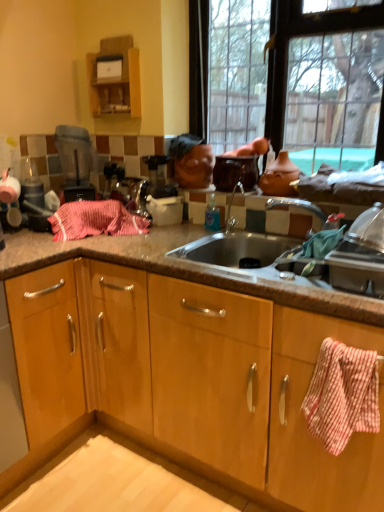
You are a GUI agent. You are given a task and a screenshot of the screen. Output one action in this format:
    pyautogui.click(x=<x>, y=<y>)
    Task: Click on the pink woven towel at center
    The width and height of the screenshot is (384, 512).
    Given the screenshot: What is the action you would take?
    pyautogui.click(x=95, y=220)

Measure the distance between glossy ceramic pot at upper center, the 1th appliance when ordered from right to left, and camera.

The distance of glossy ceramic pot at upper center, the 1th appliance when ordered from right to left, from camera is 6.25 feet.

Find the location of a particular element. red checkered towel at right, the 2th cabinetry viewed from the left is located at coordinates (306, 422).

I want to click on matte black blender at upper left, the 1th appliance positioned from the left, so click(x=75, y=162).

The height and width of the screenshot is (512, 384). I want to click on pink woven towel at center, so click(x=95, y=220).

Considering the positions of objects matte black blender at upper left, which appears as the 2th appliance when viewed from the right, and wooden cabinet at upper left, the second cabinetry positioned from the bottom, in the image provided, who is more to the left, matte black blender at upper left, which appears as the 2th appliance when viewed from the right, or wooden cabinet at upper left, the second cabinetry positioned from the bottom,?

matte black blender at upper left, which appears as the 2th appliance when viewed from the right, is more to the left.

Considering the sizes of objects matte black blender at upper left, the 1th appliance positioned from the left, and wooden cabinet at upper left, which ranks as the first cabinetry in top-to-bottom order, in the image provided, who is wider, matte black blender at upper left, the 1th appliance positioned from the left, or wooden cabinet at upper left, which ranks as the first cabinetry in top-to-bottom order,?

Wider between the two is matte black blender at upper left, the 1th appliance positioned from the left.

Where is `appliance on the left side of wooden cabinet at upper left, acting as the 1th cabinetry starting from the left`? This screenshot has width=384, height=512. appliance on the left side of wooden cabinet at upper left, acting as the 1th cabinetry starting from the left is located at coordinates (75, 162).

What's the angular difference between matte black blender at upper left, which appears as the 2th appliance when viewed from the right, and wooden cabinet at upper left, acting as the first cabinetry starting from the back,'s facing directions?

They differ by 52.9 degrees in their facing directions.

Which object is further away from the camera taking this photo, glossy ceramic pot at upper center, the 1th appliance when ordered from right to left, or matte black blender at upper left, the 1th appliance positioned from the left?

Positioned behind is matte black blender at upper left, the 1th appliance positioned from the left.

Considering the points (234, 174) and (74, 194), which point is behind, point (234, 174) or point (74, 194)?

Positioned behind is point (74, 194).

Which is more to the left, glossy ceramic pot at upper center, which is counted as the 2th appliance, starting from the left, or matte black blender at upper left, the 1th appliance positioned from the left?

matte black blender at upper left, the 1th appliance positioned from the left, is more to the left.

Which of these two, glossy ceramic pot at upper center, which is counted as the 2th appliance, starting from the left, or matte black blender at upper left, which appears as the 2th appliance when viewed from the right, is wider?

With larger width is matte black blender at upper left, which appears as the 2th appliance when viewed from the right.

I want to click on blanket that appears below the glossy ceramic pot at upper center, the 1th appliance when ordered from right to left (from the image's perspective), so click(95, 220).

Is pink woven towel at center further to the viewer compared to glossy ceramic pot at upper center, the 1th appliance when ordered from right to left?

No, pink woven towel at center is closer to the camera.

Does pink woven towel at center turn towards glossy ceramic pot at upper center, which is counted as the 2th appliance, starting from the left?

No, pink woven towel at center does not turn towards glossy ceramic pot at upper center, which is counted as the 2th appliance, starting from the left.

Is pink woven towel at center not inside glossy ceramic pot at upper center, which is counted as the 2th appliance, starting from the left?

Yes.

Is matte glass window at upper center with glossy ceramic pot at upper center, the 1th appliance when ordered from right to left?

No, matte glass window at upper center is not in contact with glossy ceramic pot at upper center, the 1th appliance when ordered from right to left.

What's the angular difference between matte glass window at upper center and glossy ceramic pot at upper center, which is counted as the 2th appliance, starting from the left,'s facing directions?

The angular difference between matte glass window at upper center and glossy ceramic pot at upper center, which is counted as the 2th appliance, starting from the left, is 1.32 degrees.

Considering the points (296, 16) and (225, 162), which point is behind, point (296, 16) or point (225, 162)?

The point (225, 162) is behind.

Does matte glass window at upper center have a lesser width compared to glossy ceramic pot at upper center, which is counted as the 2th appliance, starting from the left?

Indeed, matte glass window at upper center has a lesser width compared to glossy ceramic pot at upper center, which is counted as the 2th appliance, starting from the left.

Locate an element on the screen. The width and height of the screenshot is (384, 512). appliance that is the 1st one when counting upward from the pink woven towel at center (from the image's perspective) is located at coordinates (75, 162).

Can you confirm if matte black blender at upper left, the 1th appliance positioned from the left, is smaller than pink woven towel at center?

Yes, matte black blender at upper left, the 1th appliance positioned from the left, is smaller than pink woven towel at center.

Looking at this image, from a real-world perspective, relative to pink woven towel at center, is matte black blender at upper left, which appears as the 2th appliance when viewed from the right, vertically above or below?

From a real-world perspective, matte black blender at upper left, which appears as the 2th appliance when viewed from the right, is physically above pink woven towel at center.

Could you tell me if matte black blender at upper left, the 1th appliance positioned from the left, is turned towards pink woven towel at center?

Yes, matte black blender at upper left, the 1th appliance positioned from the left, is facing pink woven towel at center.

Who is shorter, matte glass window at upper center or pink woven towel at center?

With less height is pink woven towel at center.

From the picture: Based on their positions, is matte glass window at upper center located to the left or right of pink woven towel at center?

matte glass window at upper center is positioned on pink woven towel at center's right side.

Looking at the image, does matte glass window at upper center seem bigger or smaller compared to pink woven towel at center?

matte glass window at upper center is bigger than pink woven towel at center.

Is pink woven towel at center to the left or to the right of matte glass window at upper center in the image?

pink woven towel at center is positioned on matte glass window at upper center's left side.

Is pink woven towel at center smaller than matte glass window at upper center?

Indeed, pink woven towel at center has a smaller size compared to matte glass window at upper center.

Is pink woven towel at center located outside matte glass window at upper center?

Absolutely, pink woven towel at center is external to matte glass window at upper center.

Is pink woven towel at center oriented away from matte glass window at upper center?

That's not correct — pink woven towel at center is not looking away from matte glass window at upper center.

Locate an element on the screen. Image resolution: width=384 pixels, height=512 pixels. cabinetry that appears above the matte black blender at upper left, the 1th appliance positioned from the left (from a real-world perspective) is located at coordinates (114, 78).

Identify the location of appliance that is above the matte black blender at upper left, which appears as the 2th appliance when viewed from the right (from the image's perspective). (235, 172).

Considering their positions, is matte black blender at upper left, the 1th appliance positioned from the left, positioned closer to glossy ceramic pot at upper center, which is counted as the 2th appliance, starting from the left, than red checkered towel at right, which is the second cabinetry from back to front?

matte black blender at upper left, the 1th appliance positioned from the left.

Looking at the image, which one is located further to wooden cabinet at upper left, the second cabinetry positioned from the bottom, red checkered towel at right, which is counted as the 1th cabinetry, starting from the front, or glossy ceramic pot at upper center, the 1th appliance when ordered from right to left?

Based on the image, red checkered towel at right, which is counted as the 1th cabinetry, starting from the front, appears to be further to wooden cabinet at upper left, the second cabinetry positioned from the bottom.

Looking at the image, which one is located closer to wooden cabinet at upper left, which ranks as the first cabinetry in top-to-bottom order, red checkered towel at right, which is counted as the 1th cabinetry, starting from the front, or pink woven towel at center?

The object closer to wooden cabinet at upper left, which ranks as the first cabinetry in top-to-bottom order, is pink woven towel at center.

Based on their spatial positions, is glossy ceramic pot at upper center, which is counted as the 2th appliance, starting from the left, or matte glass window at upper center closer to wooden cabinet at upper left, the 2th cabinetry in the right-to-left sequence?

matte glass window at upper center is closer to wooden cabinet at upper left, the 2th cabinetry in the right-to-left sequence.

Looking at this image, considering their positions, is wooden cabinet at upper left, which ranks as the first cabinetry in top-to-bottom order, positioned closer to matte black blender at upper left, which appears as the 2th appliance when viewed from the right, than pink woven towel at center?

The object closer to matte black blender at upper left, which appears as the 2th appliance when viewed from the right, is pink woven towel at center.

Looking at the image, which one is located further to pink woven towel at center, matte black blender at upper left, which appears as the 2th appliance when viewed from the right, or glossy ceramic pot at upper center, the 1th appliance when ordered from right to left?

glossy ceramic pot at upper center, the 1th appliance when ordered from right to left, is further to pink woven towel at center.

Based on the photo, when comparing their distances from pink woven towel at center, does red checkered towel at right, the 2th cabinetry viewed from the left, or wooden cabinet at upper left, which ranks as the first cabinetry in top-to-bottom order, seem closer?

The object closer to pink woven towel at center is wooden cabinet at upper left, which ranks as the first cabinetry in top-to-bottom order.

Estimate the real-world distances between objects in this image. Which object is further from matte black blender at upper left, the 1th appliance positioned from the left, pink woven towel at center or red checkered towel at right, positioned as the 1th cabinetry in right-to-left order?

red checkered towel at right, positioned as the 1th cabinetry in right-to-left order, is positioned further to the anchor matte black blender at upper left, the 1th appliance positioned from the left.

Locate an element on the screen. The width and height of the screenshot is (384, 512). appliance between matte black blender at upper left, which appears as the 2th appliance when viewed from the right, and matte glass window at upper center from left to right is located at coordinates (235, 172).

In order to click on appliance between pink woven towel at center and matte glass window at upper center in the horizontal direction in this screenshot , I will do `click(235, 172)`.

You are a GUI agent. You are given a task and a screenshot of the screen. Output one action in this format:
    pyautogui.click(x=<x>, y=<y>)
    Task: Click on the blanket situated between matte black blender at upper left, which appears as the 2th appliance when viewed from the right, and matte glass window at upper center from left to right
    
    Given the screenshot: What is the action you would take?
    pyautogui.click(x=95, y=220)

Identify the location of window that lies between wooden cabinet at upper left, which appears as the 2th cabinetry when viewed from the front, and red checkered towel at right, which is the second cabinetry from back to front, from top to bottom. The image size is (384, 512). (296, 79).